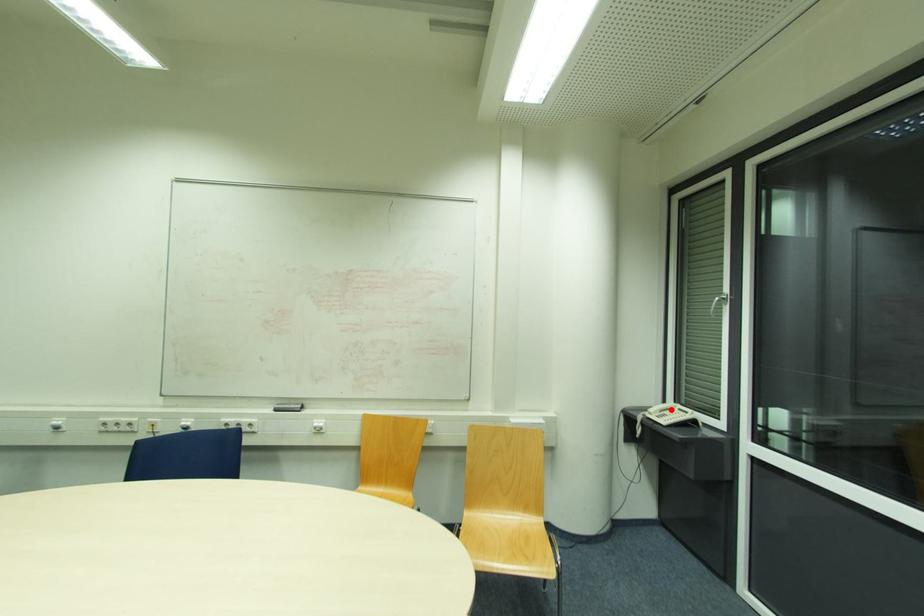
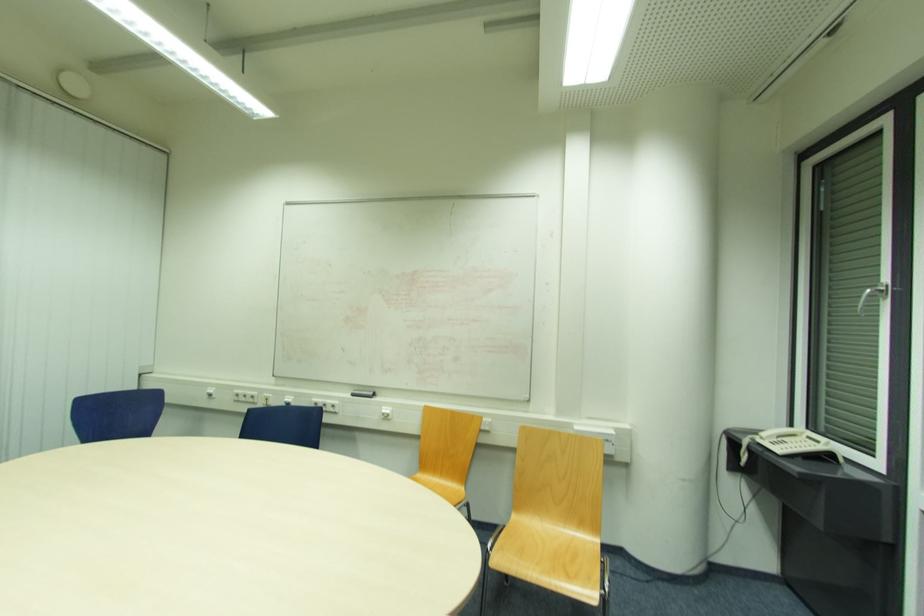
Locate, in the second image, the point that corresponds to the highlighted location in the first image.

(793, 436)